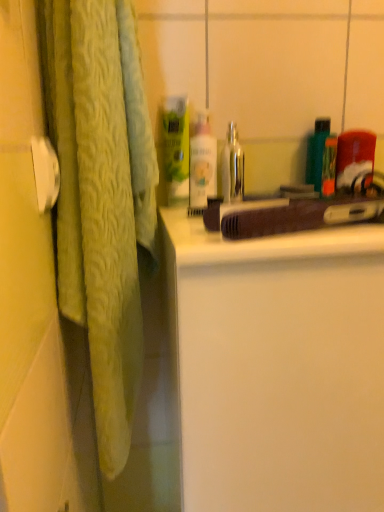
Question: Is the depth of white glossy lotion at center greater than that of shiny metallic faucet at center?

Choices:
 (A) no
 (B) yes

Answer: (A)

Question: Can you confirm if white glossy lotion at center is bigger than shiny metallic faucet at center?

Choices:
 (A) no
 (B) yes

Answer: (B)

Question: Considering the relative sizes of white glossy lotion at center and shiny metallic faucet at center in the image provided, is white glossy lotion at center smaller than shiny metallic faucet at center?

Choices:
 (A) no
 (B) yes

Answer: (A)

Question: Is white glossy lotion at center shorter than shiny metallic faucet at center?

Choices:
 (A) yes
 (B) no

Answer: (B)

Question: Does white glossy lotion at center have a greater width compared to shiny metallic faucet at center?

Choices:
 (A) no
 (B) yes

Answer: (A)

Question: Can you confirm if white glossy lotion at center is taller than shiny metallic faucet at center?

Choices:
 (A) yes
 (B) no

Answer: (A)

Question: Is shiny metallic faucet at center outside white matte cabinet at center?

Choices:
 (A) no
 (B) yes

Answer: (B)

Question: Is white matte cabinet at center surrounded by shiny metallic faucet at center?

Choices:
 (A) no
 (B) yes

Answer: (A)

Question: Is shiny metallic faucet at center positioned in front of white matte cabinet at center?

Choices:
 (A) yes
 (B) no

Answer: (B)

Question: Is shiny metallic faucet at center oriented away from white matte cabinet at center?

Choices:
 (A) yes
 (B) no

Answer: (B)

Question: Can you confirm if shiny metallic faucet at center is smaller than white matte cabinet at center?

Choices:
 (A) yes
 (B) no

Answer: (A)

Question: Considering the relative sizes of shiny metallic faucet at center and white matte cabinet at center in the image provided, is shiny metallic faucet at center bigger than white matte cabinet at center?

Choices:
 (A) yes
 (B) no

Answer: (B)

Question: Considering the relative sizes of brown matte hairdryer at center and white matte cabinet at center in the image provided, is brown matte hairdryer at center wider than white matte cabinet at center?

Choices:
 (A) yes
 (B) no

Answer: (B)